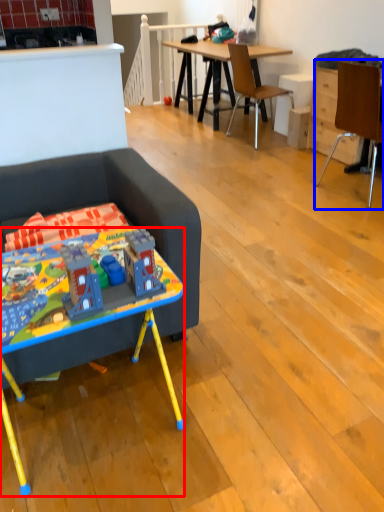
Question: Which of the following is the farthest to the observer, desk (highlighted by a red box) or chair (highlighted by a blue box)?

Choices:
 (A) desk
 (B) chair

Answer: (B)